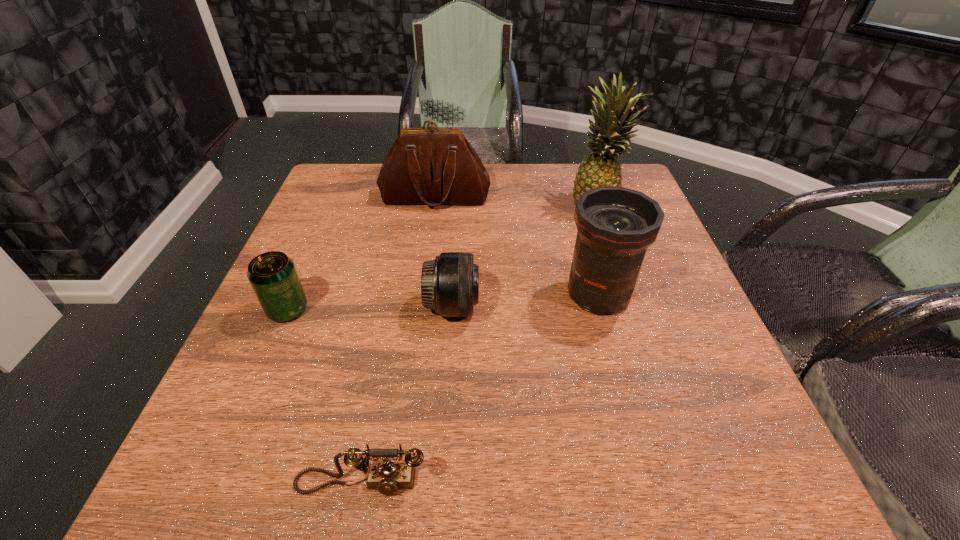
In order to click on the tallest object in this screenshot , I will do `click(610, 132)`.

Locate an element on the screen. The image size is (960, 540). shoulder bag is located at coordinates (431, 166).

This screenshot has height=540, width=960. Find the location of `the taller telephoto lens`. the taller telephoto lens is located at coordinates (616, 225).

At what (x,y) coordinates should I click in order to perform the action: click on the left telephoto lens. Please return your answer as a coordinate pair (x, y). Looking at the image, I should click on (449, 284).

Where is `beer can`? The width and height of the screenshot is (960, 540). beer can is located at coordinates (273, 276).

Where is `the shortest object`? the shortest object is located at coordinates pos(387,477).

Where is `telephone`? This screenshot has height=540, width=960. telephone is located at coordinates (387, 477).

I want to click on vacant area situated 0.370m on the front of the pineapple, so click(x=643, y=335).

Find the location of a particular element. free spot located 0.210m on the right of the shoulder bag is located at coordinates (567, 197).

At what (x,y) coordinates should I click in order to perform the action: click on vacant space positioned 0.200m on the left of the taller telephoto lens. Please return your answer as a coordinate pair (x, y). Image resolution: width=960 pixels, height=540 pixels. Looking at the image, I should click on (468, 294).